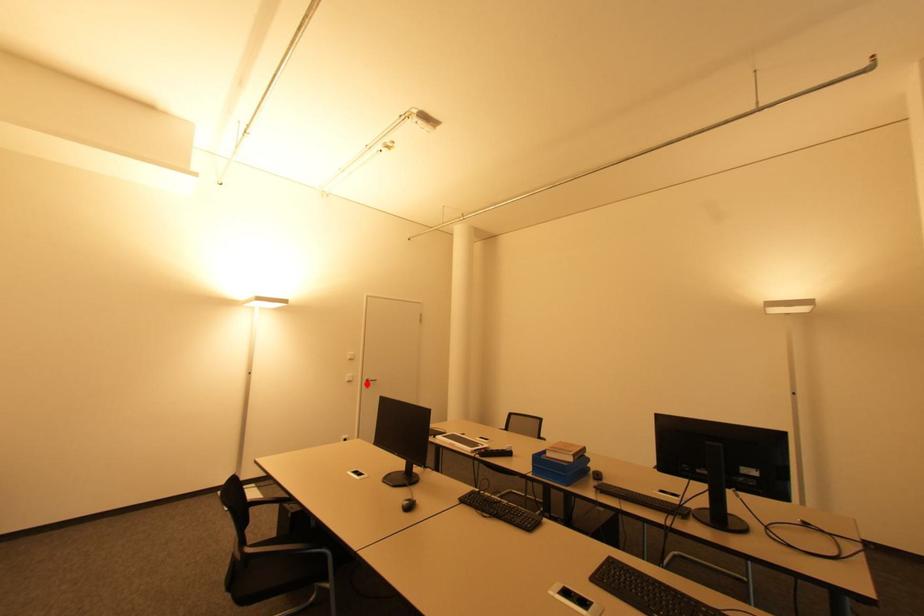
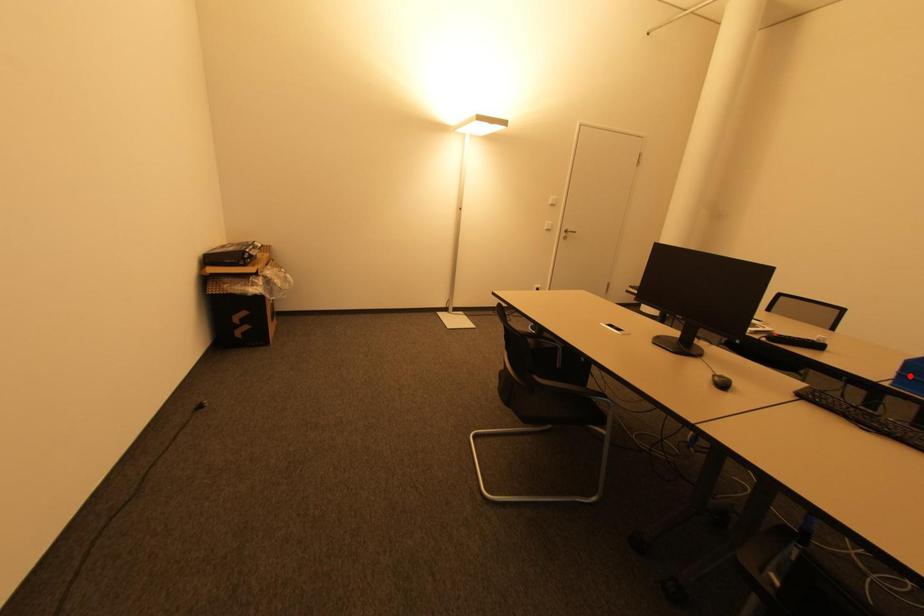
I am providing you with two images of the same scene from different viewpoints. A red point is marked on the first image and another point is marked on the second image. Does the point marked in image1 correspond to the same location as the one in image2?

No